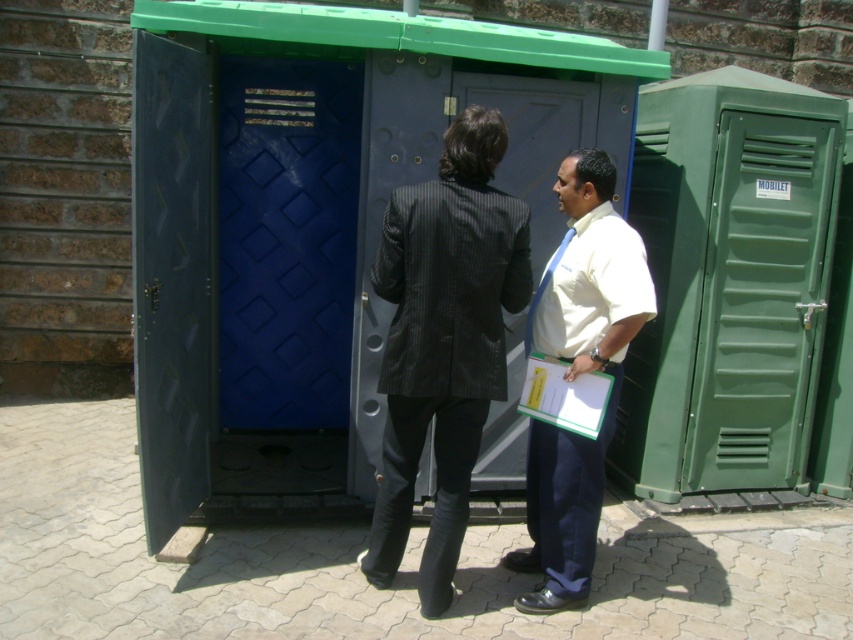
In the scene shown: You are standing at the point marked by coordinates (x=444, y=340) in the image. Looking around, you see a portable restroom with green roof and blue doors. Which direction should you face to see the person in the dark gray pinstripe suit at center?

The point at coordinates (x=444, y=340) marks the dark gray pinstripe suit at center, so you are already facing the person in the dark gray pinstripe suit at center.

You are standing in front of a portable restroom with two doors. You need to determine which object, the green plastic door at right or the white shirt at center, is taller. Based on the scene description, which one is taller?

The green plastic door at right has a greater height compared to the white shirt at center, so the green plastic door at right is taller.